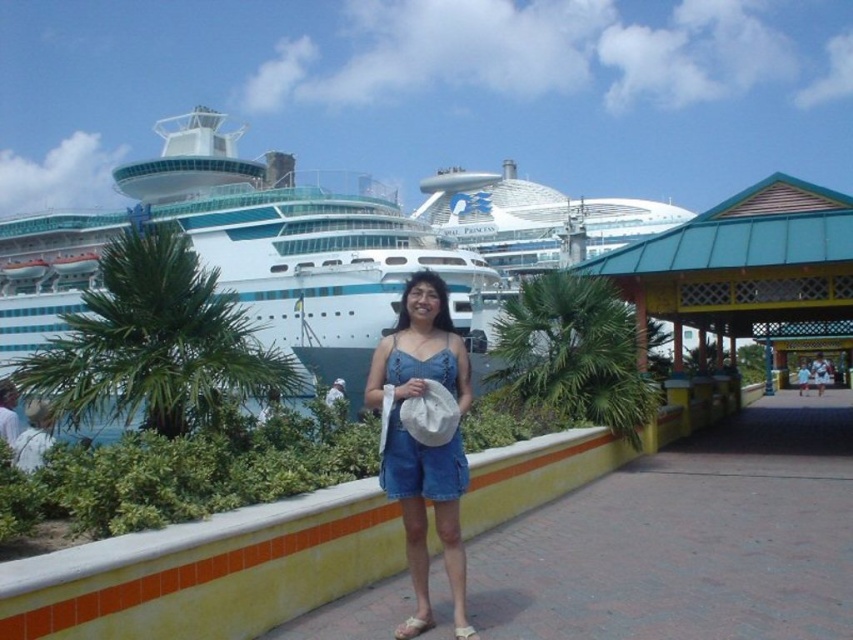
Is white glossy cruise ship at upper left taller than white glossy cruise ship at center?

Correct, white glossy cruise ship at upper left is much taller as white glossy cruise ship at center.

Which of these two, white glossy cruise ship at upper left or white glossy cruise ship at center, stands shorter?

white glossy cruise ship at center

Which is behind, point (308, 221) or point (445, 195)?

Point (445, 195)

This screenshot has width=853, height=640. In order to click on white glossy cruise ship at upper left in this screenshot , I will do pos(294,243).

Between denim shorts at center and white glossy cruise ship at center, which one has less height?

Standing shorter between the two is denim shorts at center.

Identify the location of denim shorts at center. The height and width of the screenshot is (640, 853). (422, 444).

Image resolution: width=853 pixels, height=640 pixels. In order to click on denim shorts at center in this screenshot , I will do `click(422, 444)`.

Is white glossy cruise ship at upper left further to the viewer compared to denim shorts at center?

That is True.

Which is below, white glossy cruise ship at upper left or denim shorts at center?

denim shorts at center is below.

Between point (357, 275) and point (405, 496), which one is positioned in front?

Point (405, 496) is more forward.

This screenshot has height=640, width=853. I want to click on white glossy cruise ship at upper left, so click(294, 243).